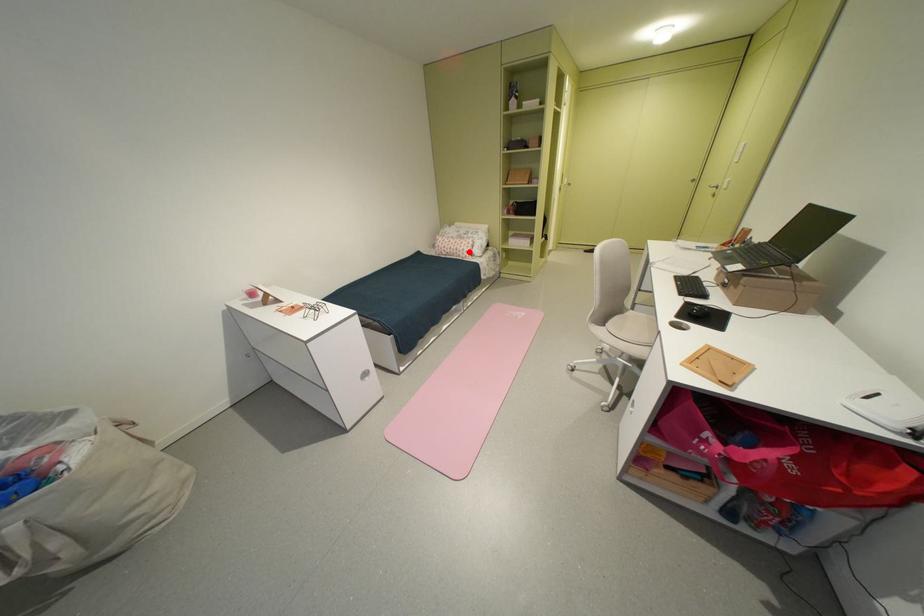
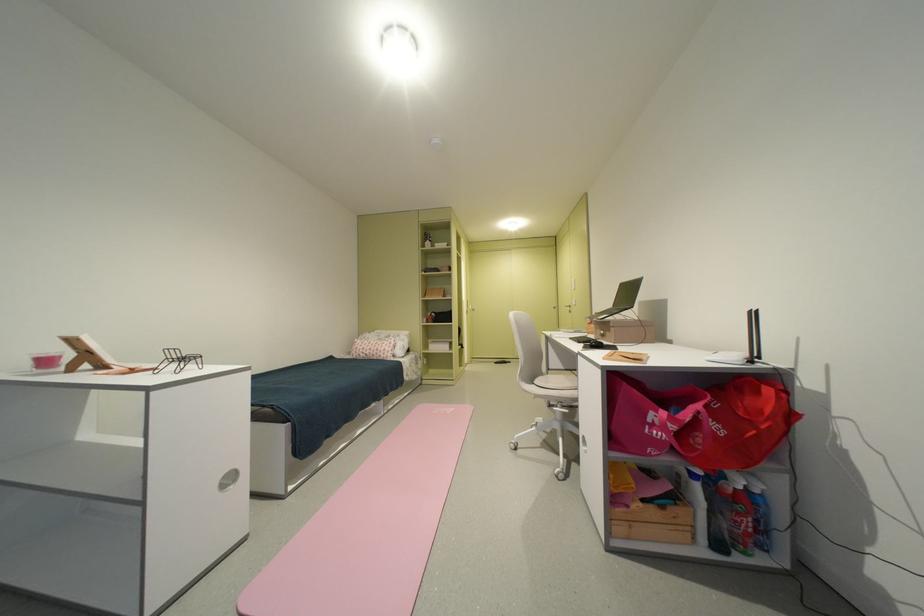
Question: I am providing you with two images of the same scene from different viewpoints. Image1 has a red point marked. In image2, the corresponding 3D location appears at what relative position? Reply with the corresponding letter.

Choices:
 (A) Closer
 (B) Farther

Answer: (B)